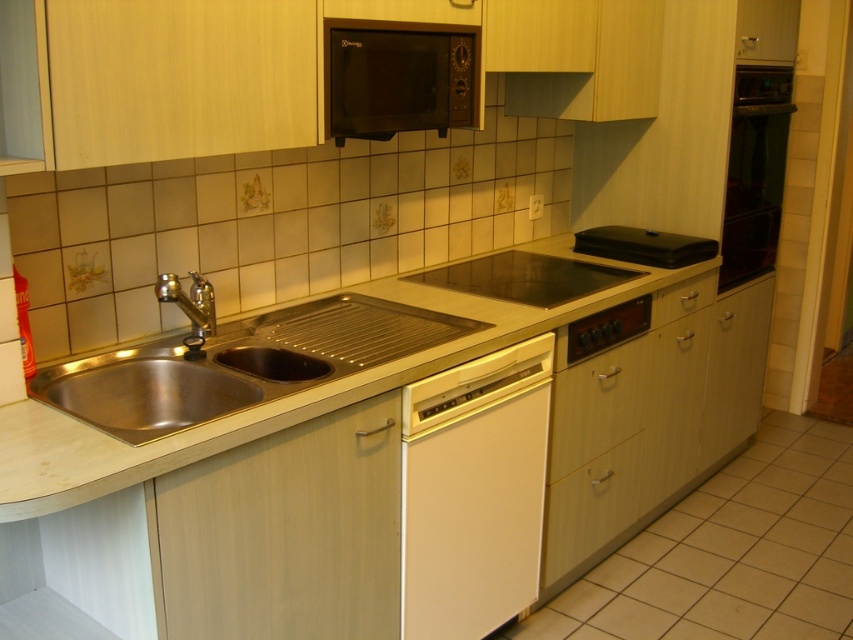
Question: Is black glass oven at right bigger than white glossy drawer at center?

Choices:
 (A) yes
 (B) no

Answer: (A)

Question: Among these points, which one is farthest from the camera?

Choices:
 (A) (779, 74)
 (B) (379, 67)
 (C) (430, 592)

Answer: (A)

Question: Is stainless steel sink at left closer to camera compared to black glass cooktop at center?

Choices:
 (A) no
 (B) yes

Answer: (B)

Question: Considering the real-world distances, which object is closest to the wooden drawer at lower center?

Choices:
 (A) wooden drawer at right
 (B) white matte dishwasher at center
 (C) black glass cooktop at center

Answer: (B)

Question: Does white glossy drawer at center appear on the left side of silver metallic faucet at left?

Choices:
 (A) no
 (B) yes

Answer: (A)

Question: Among these points, which one is farthest from the camera?

Choices:
 (A) (575, 378)
 (B) (575, 291)

Answer: (B)